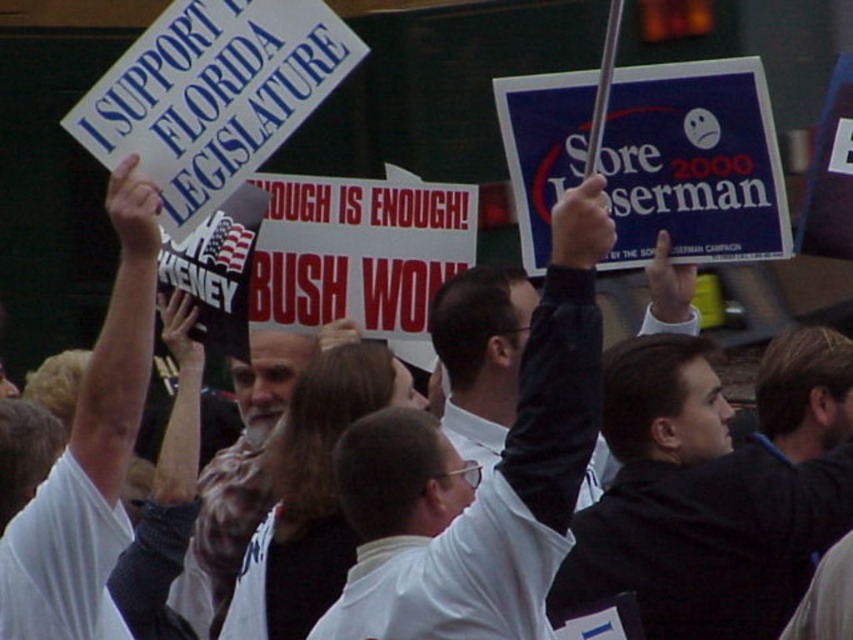
You are a photographer at the rally and want to capture a photo that includes both the white matte shirt at center and the black matte jacket at upper right. Which of the two items should you focus on first to ensure they are both in frame?

You should focus on the white matte shirt at center first because it is taller than the black matte jacket at upper right, so it will occupy more space in the frame and ensure both are visible.

Which object is located at the coordinates point (698, 506)?

The point (698, 506) is located on the black matte jacket at upper right.